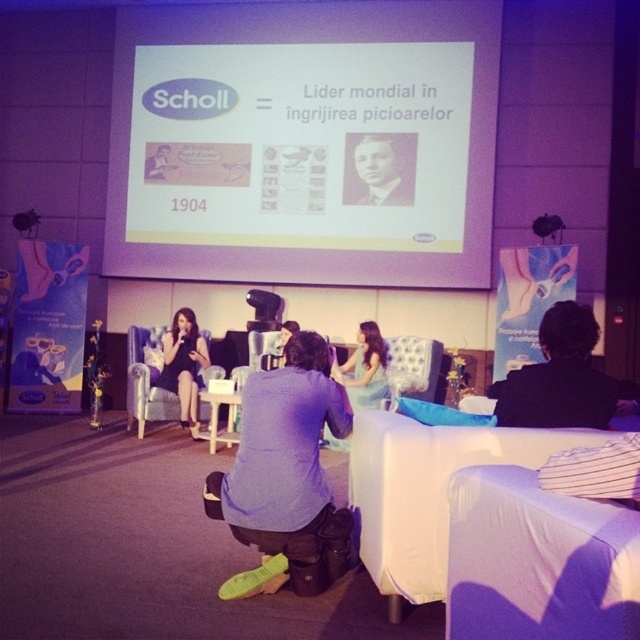
Who is lower down, black fabric jacket at center or black satin dress at lower left?

Positioned lower is black satin dress at lower left.

Who is taller, black fabric jacket at center or black satin dress at lower left?

black satin dress at lower left is taller.

You are a GUI agent. You are given a task and a screenshot of the screen. Output one action in this format:
    pyautogui.click(x=<x>, y=<y>)
    Task: Click on the black fabric jacket at center
    
    Given the screenshot: What is the action you would take?
    pyautogui.click(x=557, y=378)

Can you confirm if white matte projection screen at center is smaller than black and white photograph of man at upper center?

No, white matte projection screen at center is not smaller than black and white photograph of man at upper center.

Does white matte projection screen at center have a larger size compared to black and white photograph of man at upper center?

Correct, white matte projection screen at center is larger in size than black and white photograph of man at upper center.

Between point (307, 269) and point (371, 156), which one is positioned in front?

Positioned in front is point (371, 156).

Image resolution: width=640 pixels, height=640 pixels. Find the location of `white matte projection screen at center`. white matte projection screen at center is located at coordinates (301, 141).

Can you confirm if white matte projection screen at center is thinner than purple fabric shirt at center?

In fact, white matte projection screen at center might be wider than purple fabric shirt at center.

Does white matte projection screen at center appear on the right side of purple fabric shirt at center?

Yes, white matte projection screen at center is to the right of purple fabric shirt at center.

Identify the location of white matte projection screen at center. This screenshot has height=640, width=640. (301, 141).